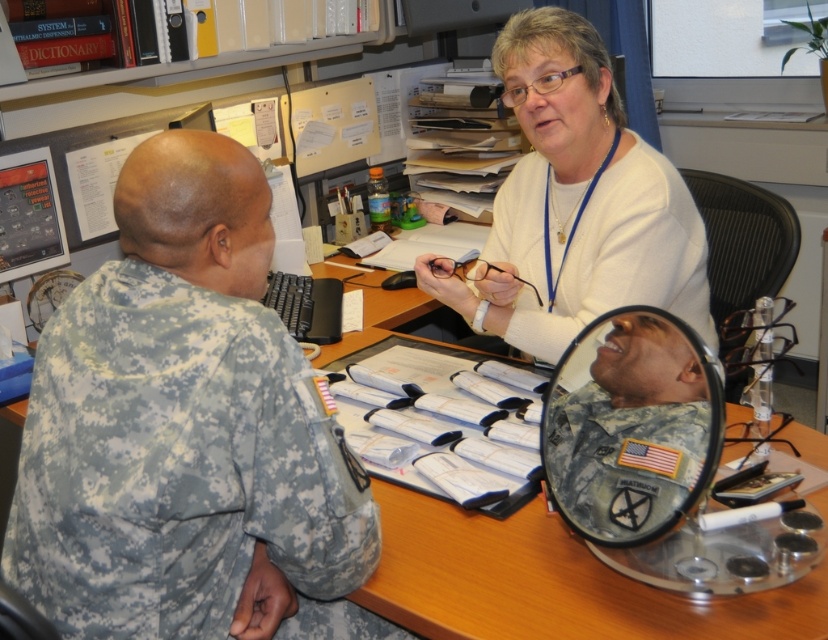
You are an interior designer assessing the office layout. The camouflage uniform at left and the white matte sweater at upper center are two key elements. Which object takes up more horizontal space in the scene?

→ The white matte sweater at upper center takes up more horizontal space than the camouflage uniform at left because it has a greater width according to the description.